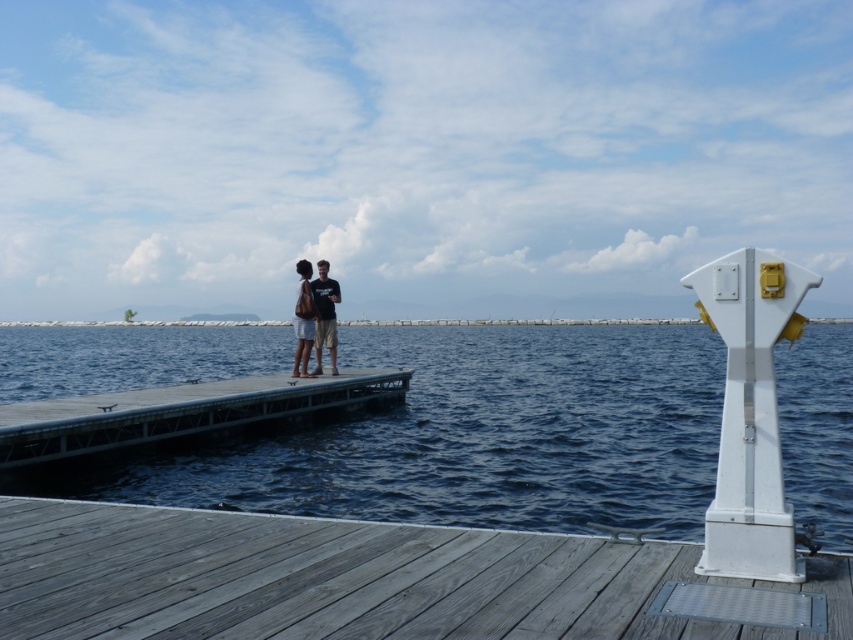
You are planning to build a small boat that is 2 meters wide. You want to know if it can fit in the space between the blue water at center and the gray wooden dock at lower center. Can it fit?

The blue water at center is wider than the gray wooden dock at lower center. Since the boat is 2 meters wide, it depends on the actual width of the blue water at center. However, since the water is wider than the dock, there might be enough space. But without exact measurements, we can only confirm the comparative width.

You are standing at the point marked by the coordinates point (344, 579) on the gray wooden dock at lower center. You want to walk towards the two people on the dock. Which direction should you move relative to the gray wooden dock at lower center?

The point (344, 579) marks the gray wooden dock at lower center. To reach the two people on the dock, you should move towards the upper part of the dock since they are positioned in another section of the dock in the midground, which is further along the dock from the lower center position.